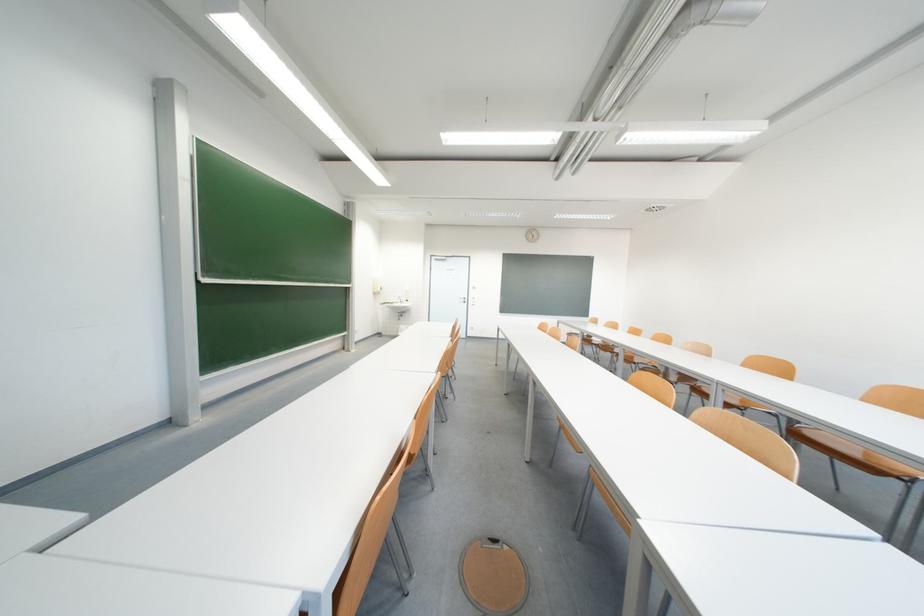
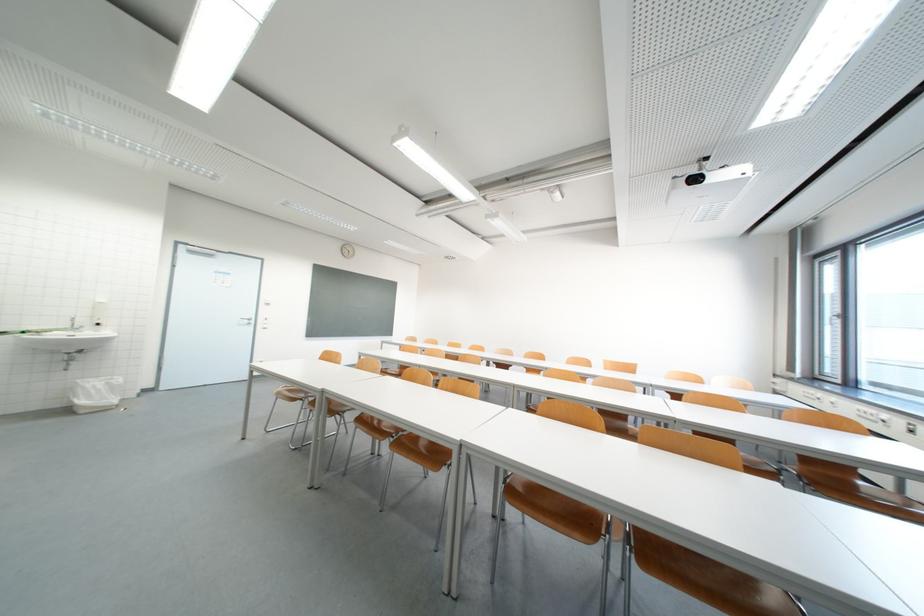
The point at (475,302) is marked in the first image. Where is the corresponding point in the second image?

(261, 323)